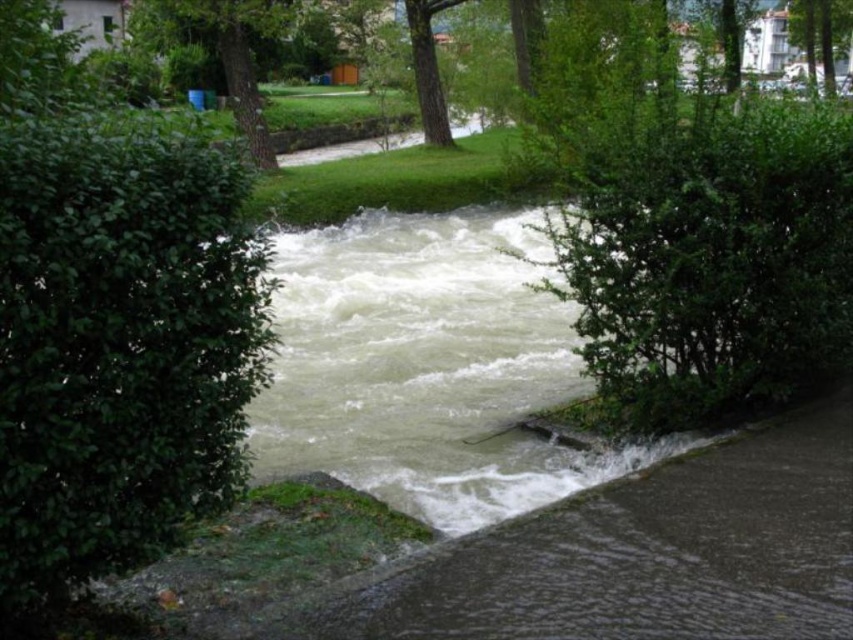
Question: Does green leafy hedge at left lie in front of green leafy hedge at center?

Choices:
 (A) no
 (B) yes

Answer: (B)

Question: Is green leafy hedge at center positioned in front of green leafy tree at upper center?

Choices:
 (A) no
 (B) yes

Answer: (B)

Question: Is green leafy hedge at left below green leafy tree at center?

Choices:
 (A) yes
 (B) no

Answer: (A)

Question: Considering the real-world distances, which object is farthest from the green leafy hedge at center?

Choices:
 (A) green leafy hedge at left
 (B) green leafy tree at upper center

Answer: (B)

Question: Considering the real-world distances, which object is closest to the green leafy hedge at left?

Choices:
 (A) green leafy tree at center
 (B) green leafy hedge at center
 (C) green leafy tree at upper center

Answer: (B)

Question: Which point is farther to the camera?

Choices:
 (A) green leafy hedge at center
 (B) green leafy tree at upper center
 (C) green leafy tree at center

Answer: (C)